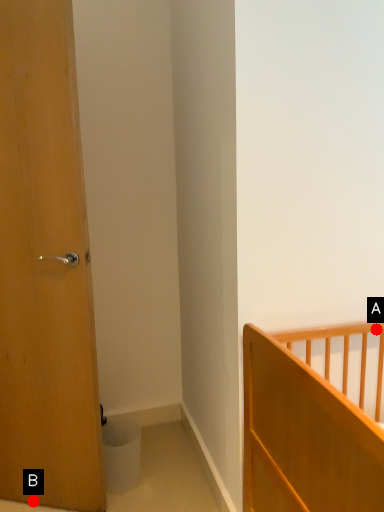
Question: Two points are circled on the image, labeled by A and B beside each circle. Among these points, which one is farthest from the camera?

Choices:
 (A) A is further
 (B) B is further

Answer: (B)